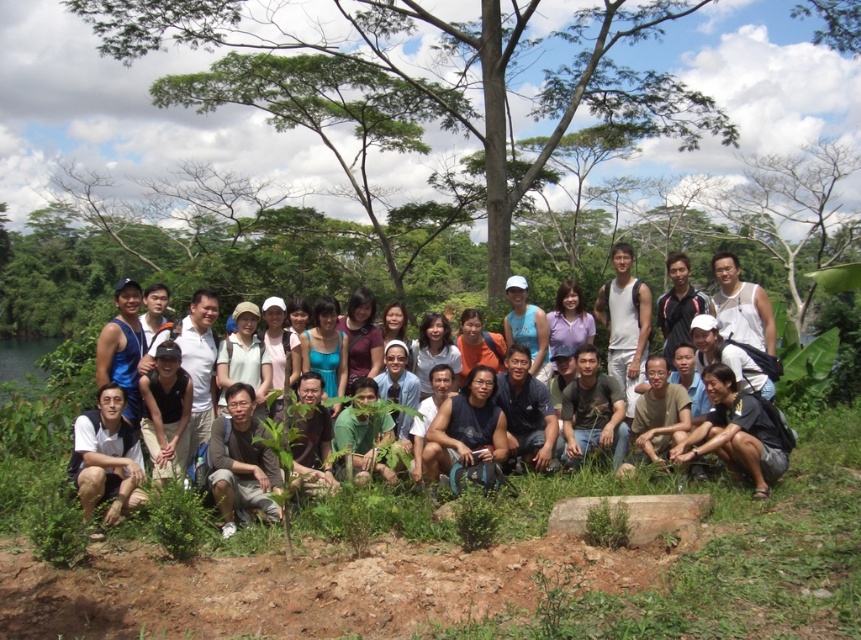
Does green leafy tree at center come behind white matte shirt at lower left?

That is True.

Is green leafy tree at center wider than white matte shirt at lower left?

Correct, the width of green leafy tree at center exceeds that of white matte shirt at lower left.

Who is more forward, (158, 1) or (127, 486)?

Point (127, 486) is in front.

This screenshot has height=640, width=861. I want to click on green leafy tree at center, so click(444, 74).

Based on the photo, which is below, green leafy tree at center or white cotton shirt at center?

white cotton shirt at center is lower down.

Can you confirm if green leafy tree at center is shorter than white cotton shirt at center?

No, green leafy tree at center is not shorter than white cotton shirt at center.

Find the location of a particular element. Image resolution: width=861 pixels, height=640 pixels. green leafy tree at center is located at coordinates (444, 74).

Between white cotton shirt at center and white matte shirt at lower left, which one is positioned higher?

white cotton shirt at center

Can you confirm if white cotton shirt at center is positioned to the right of white matte shirt at lower left?

Yes, white cotton shirt at center is to the right of white matte shirt at lower left.

Find the location of `white cotton shirt at center`. white cotton shirt at center is located at coordinates (249, 342).

What are the coordinates of `white cotton shirt at center` in the screenshot? It's located at (249, 342).